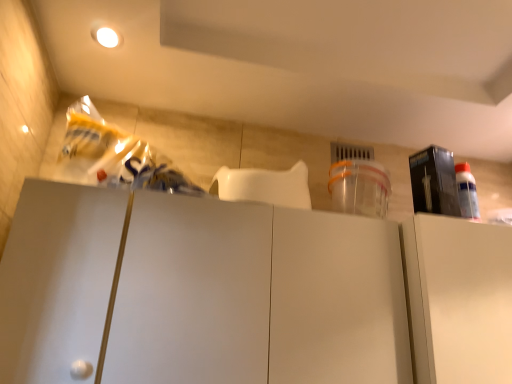
Question: From a real-world perspective, is white matte cabinet at center, the 2th cabinetry positioned from the right, physically below matte black box at upper right?

Choices:
 (A) no
 (B) yes

Answer: (B)

Question: Can you confirm if white matte cabinet at center, which ranks as the 1th cabinetry in left-to-right order, is positioned to the left of matte black box at upper right?

Choices:
 (A) yes
 (B) no

Answer: (A)

Question: Does white matte cabinet at center, the 2th cabinetry positioned from the right, appear on the right side of matte black box at upper right?

Choices:
 (A) no
 (B) yes

Answer: (A)

Question: From the image's perspective, is white matte cabinet at center, which ranks as the 1th cabinetry in left-to-right order, on matte black box at upper right?

Choices:
 (A) yes
 (B) no

Answer: (B)

Question: Could you tell me if white matte cabinet at center, the 2th cabinetry positioned from the right, is facing matte black box at upper right?

Choices:
 (A) yes
 (B) no

Answer: (B)

Question: Is white matte cabinet at center, which ranks as the 1th cabinetry in left-to-right order, oriented away from matte black box at upper right?

Choices:
 (A) yes
 (B) no

Answer: (B)

Question: From a real-world perspective, is matte black box at upper right under white matte cabinet at center, which ranks as the 1th cabinetry in left-to-right order?

Choices:
 (A) yes
 (B) no

Answer: (B)

Question: Does matte black box at upper right have a lesser height compared to white matte cabinet at center, which ranks as the 1th cabinetry in left-to-right order?

Choices:
 (A) yes
 (B) no

Answer: (A)

Question: Is the position of matte black box at upper right more distant than that of white matte cabinet at center, which ranks as the 1th cabinetry in left-to-right order?

Choices:
 (A) no
 (B) yes

Answer: (B)

Question: From a real-world perspective, is matte black box at upper right on white matte cabinet at center, the 2th cabinetry positioned from the right?

Choices:
 (A) no
 (B) yes

Answer: (B)

Question: Does matte black box at upper right have a lesser width compared to white matte cabinet at center, the 2th cabinetry positioned from the right?

Choices:
 (A) yes
 (B) no

Answer: (A)

Question: Considering the relative sizes of matte black box at upper right and white matte cabinet at center, which ranks as the 1th cabinetry in left-to-right order, in the image provided, is matte black box at upper right bigger than white matte cabinet at center, which ranks as the 1th cabinetry in left-to-right order,?

Choices:
 (A) yes
 (B) no

Answer: (B)

Question: Considering the relative sizes of white matte cabinet at right, which is the second cabinetry from left to right, and white matte cabinet at center, which ranks as the 1th cabinetry in left-to-right order, in the image provided, is white matte cabinet at right, which is the second cabinetry from left to right, smaller than white matte cabinet at center, which ranks as the 1th cabinetry in left-to-right order,?

Choices:
 (A) no
 (B) yes

Answer: (B)